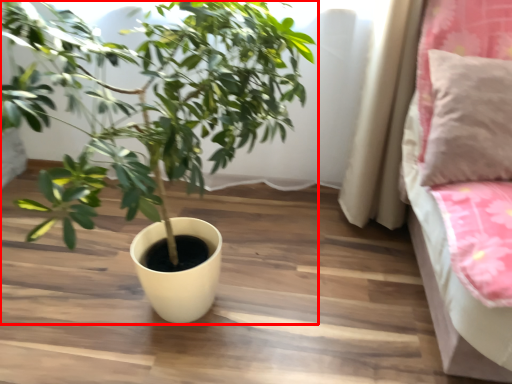
Question: In this image, where is houseplant (annotated by the red box) located relative to pillow?

Choices:
 (A) left
 (B) right

Answer: (A)